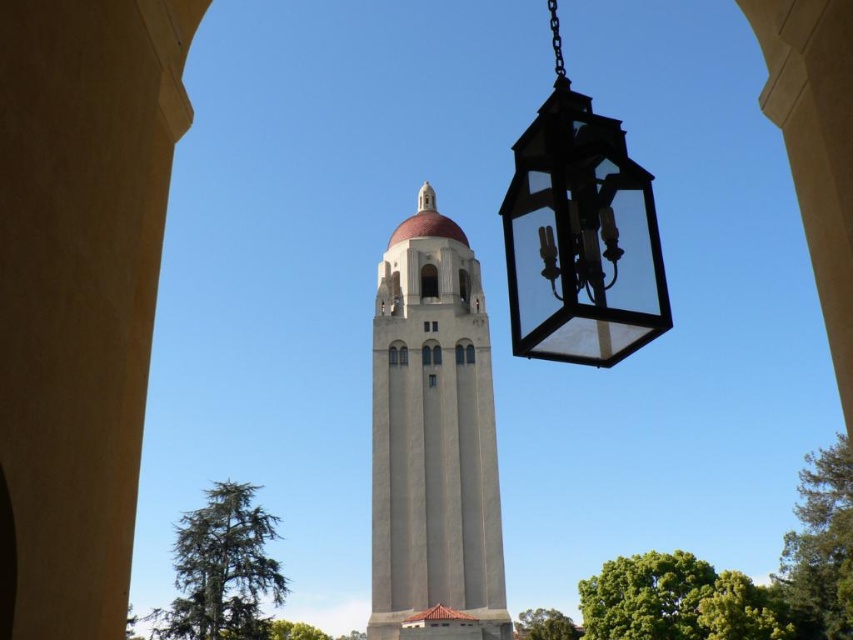
Can you confirm if smooth concrete tower at center is taller than black glass lantern at upper right?

Correct, smooth concrete tower at center is much taller as black glass lantern at upper right.

Can you confirm if smooth concrete tower at center is smaller than black glass lantern at upper right?

No, smooth concrete tower at center is not smaller than black glass lantern at upper right.

Is point (415, 524) farther from camera compared to point (614, 221)?

Yes, it is behind point (614, 221).

The height and width of the screenshot is (640, 853). I want to click on smooth concrete tower at center, so click(x=433, y=440).